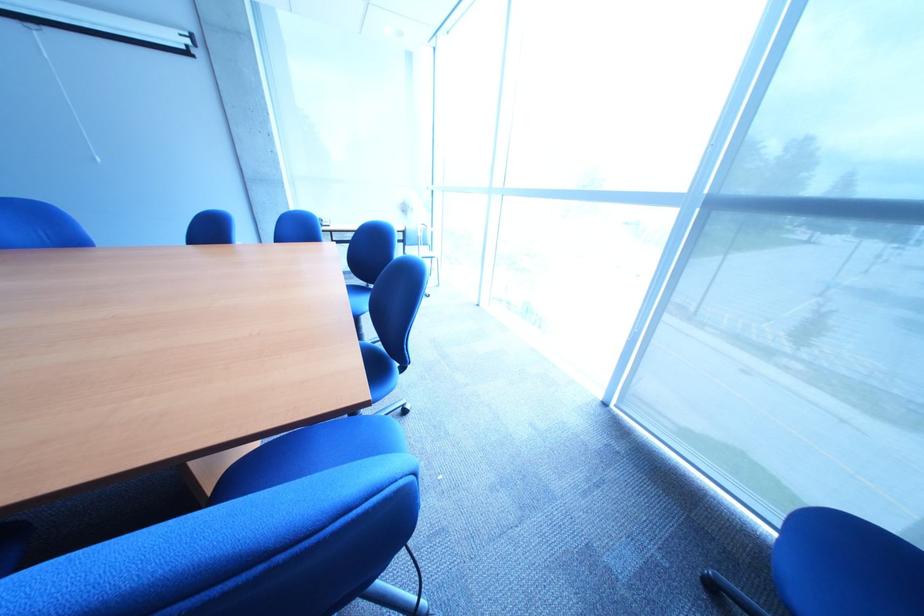
The width and height of the screenshot is (924, 616). I want to click on projector screen cord, so click(x=416, y=580).